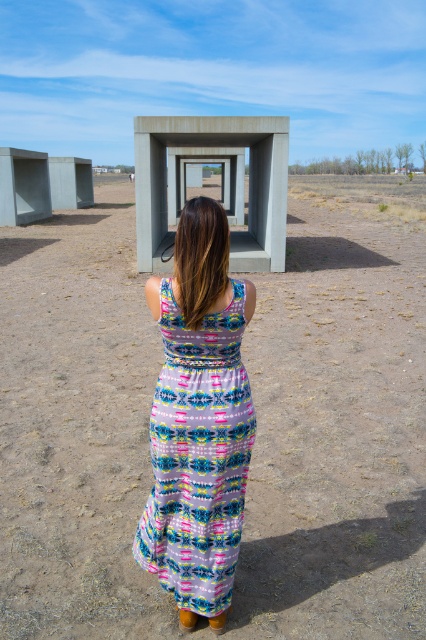
You are standing in a desert landscape and want to place a 3.5 meter long tent. The tent requires at least 3 meters of flat space. Is the brown sandy dirt at center suitable for setting up the tent?

The brown sandy dirt at center is 3.03 meters from viewer, so the tent requires at least 3 meters of flat space. Since the distance is just over 3 meters, it might be suitable, but you should verify the exact dimensions on site.

You are standing in the desert and see the brown sandy dirt at center and the concrete at center. Which one is to the right of the other?

The brown sandy dirt at center is positioned on the right side of concrete at center.

You are a photographer trying to capture the printed fabric dress at center and the brown sandy dirt at center in the same frame. If your camera has a focal length of 50mm, which object should you focus on first to ensure both are in focus?

To ensure both the printed fabric dress at center and the brown sandy dirt at center are in focus, you should focus on the printed fabric dress at center because it is closer to the camera than the brown sandy dirt at center. This is because the depth of field will extend from approximately half the distance in front of the focus point to the full distance behind it. By focusing on the closer object, more of the background will be in focus.